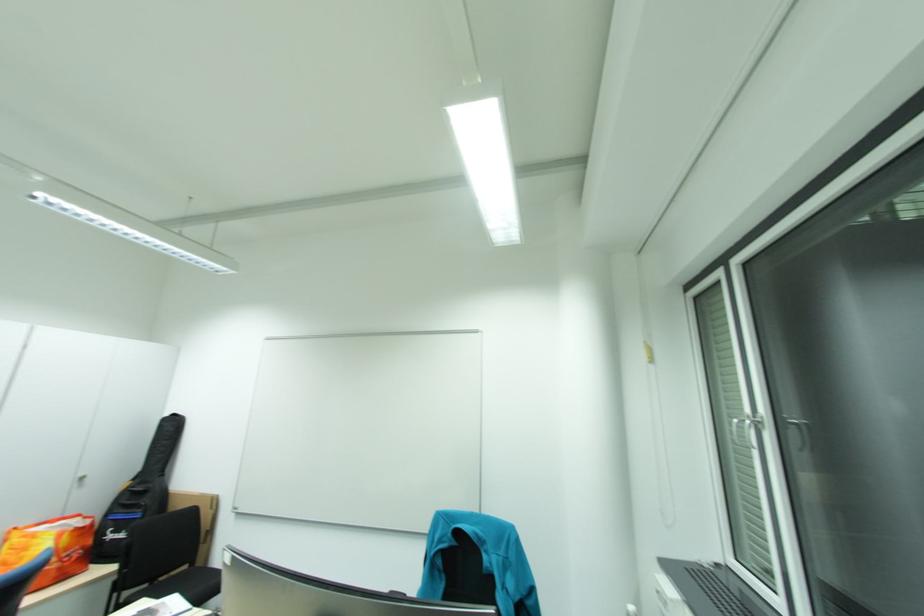
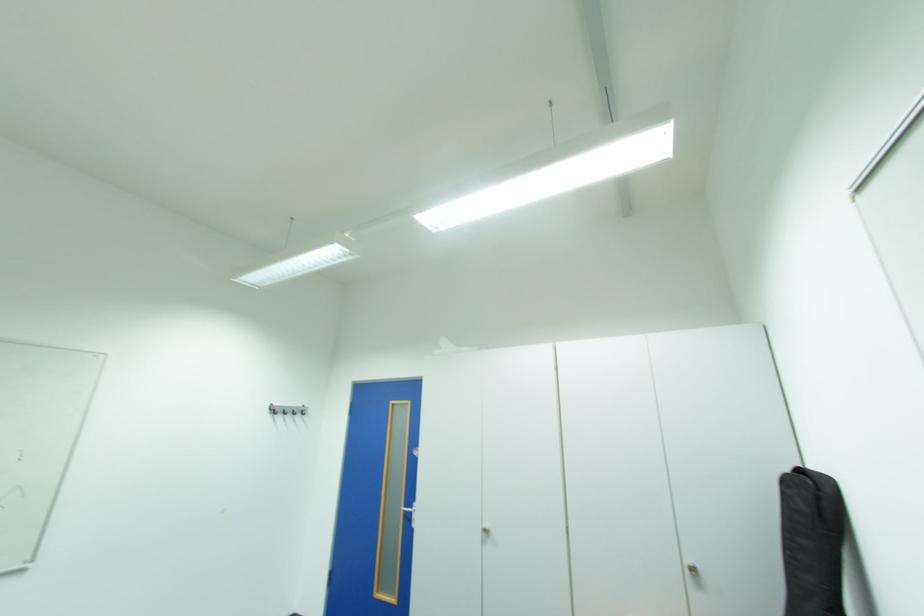
In the second image, find the point that corresponds to the point at 173,419 in the first image.

(795, 482)